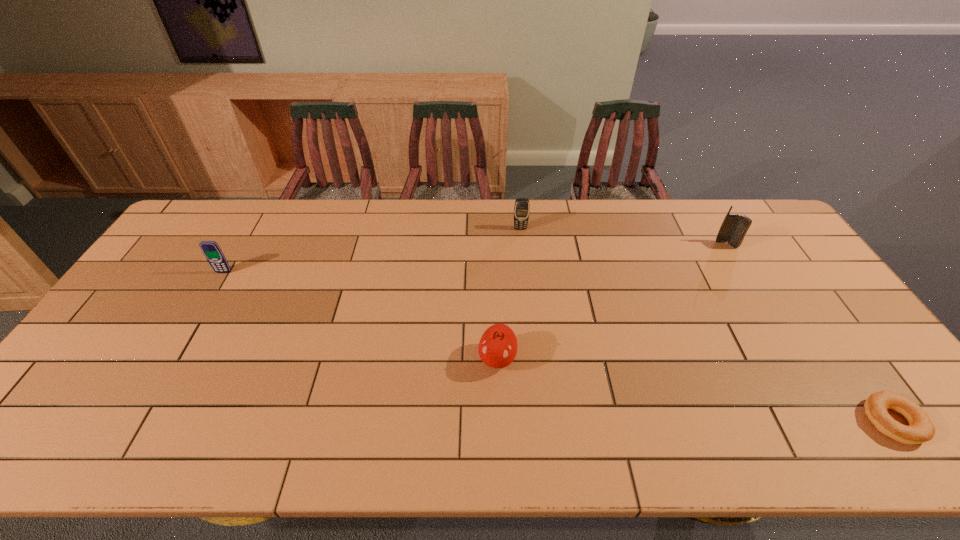
Identify the location of the second object from right to left. (734, 227).

This screenshot has height=540, width=960. What are the coordinates of `the second nearest cellular telephone` in the screenshot? It's located at (734, 227).

Where is `the third nearest object`? This screenshot has height=540, width=960. the third nearest object is located at coordinates (214, 255).

Where is `the nearest cellular telephone`? This screenshot has width=960, height=540. the nearest cellular telephone is located at coordinates (214, 255).

Where is `the second cellular telephone from right to left`? the second cellular telephone from right to left is located at coordinates (522, 206).

Where is `the third object from right to left`? The height and width of the screenshot is (540, 960). the third object from right to left is located at coordinates (522, 206).

Find the location of a particular element. the second object from left to right is located at coordinates pos(497,348).

The height and width of the screenshot is (540, 960). Find the location of `the fourth farthest object`. the fourth farthest object is located at coordinates point(497,348).

At what (x,y) coordinates should I click in order to perform the action: click on bagel. Please return your answer as a coordinate pair (x, y). The image size is (960, 540). Looking at the image, I should click on (921, 429).

Find the location of a particular element. the shortest object is located at coordinates (921, 429).